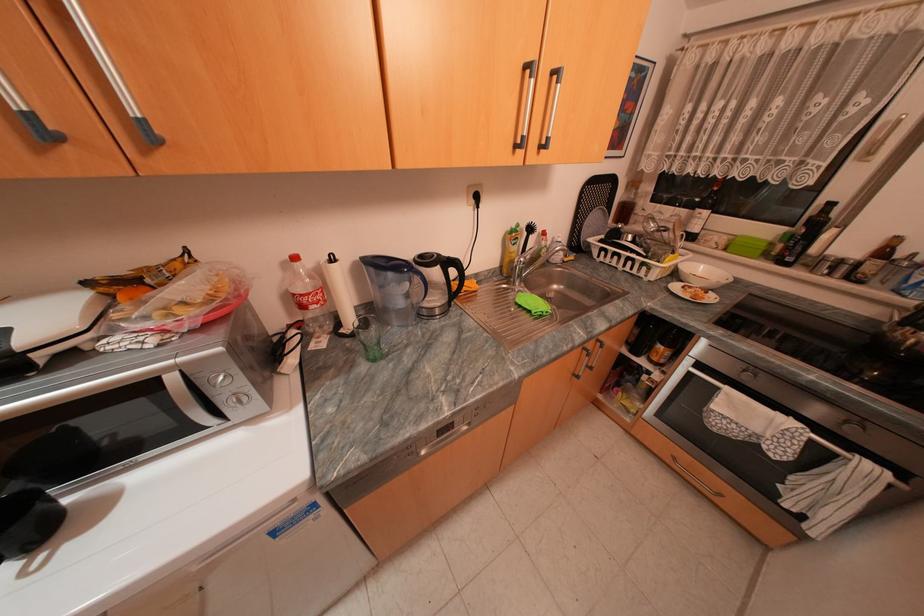
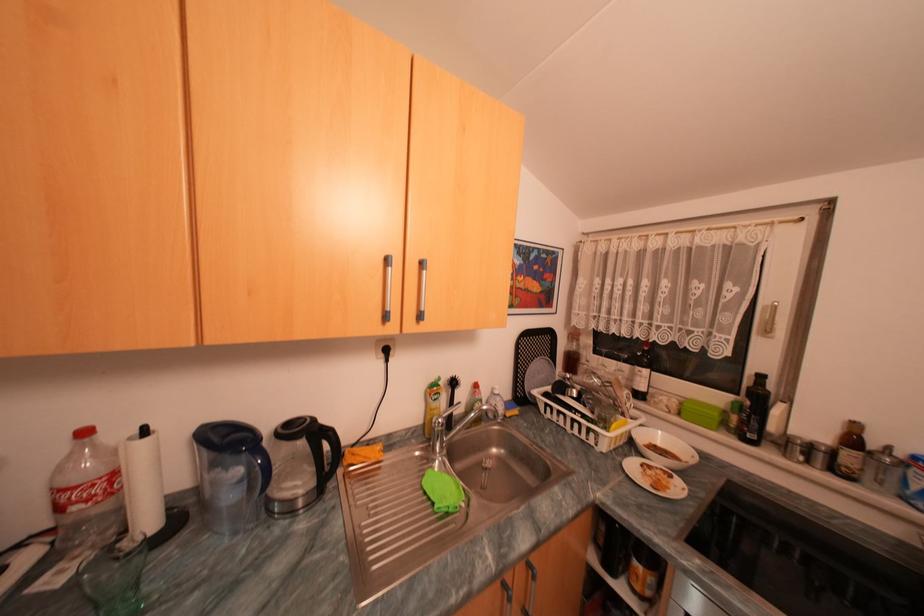
Where in the second image is the point corresponding to pixel 517 259 from the first image?

(438, 416)